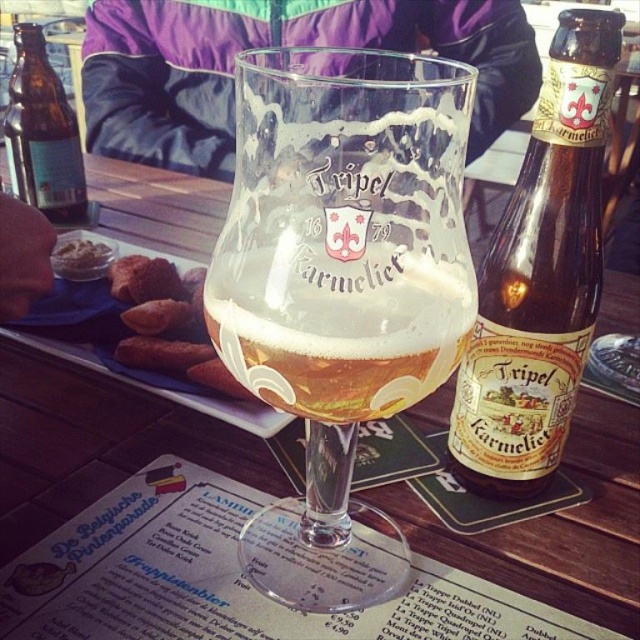
Can you confirm if clear glass beer glass at center is bigger than translucent glass beer at center?

Yes, clear glass beer glass at center is bigger than translucent glass beer at center.

The image size is (640, 640). What do you see at coordinates (340, 289) in the screenshot? I see `clear glass beer glass at center` at bounding box center [340, 289].

Locate an element on the screen. clear glass beer glass at center is located at coordinates (340, 289).

Is point (182, 460) positioned before point (17, 36)?

Yes, it is in front of point (17, 36).

Is point (74, 634) positioned after point (12, 84)?

No, it is in front of (12, 84).

This screenshot has height=640, width=640. In order to click on white paper menu at center in this screenshot , I will do `click(225, 579)`.

Locate an element on the screen. The width and height of the screenshot is (640, 640). brown glass bottle at center-right is located at coordinates (540, 275).

Does brown glass bottle at center-right have a larger size compared to brown glass bottle at left?

Indeed, brown glass bottle at center-right has a larger size compared to brown glass bottle at left.

What do you see at coordinates (540, 275) in the screenshot? The height and width of the screenshot is (640, 640). I see `brown glass bottle at center-right` at bounding box center [540, 275].

Identify the location of brown glass bottle at center-right. This screenshot has height=640, width=640. (540, 275).